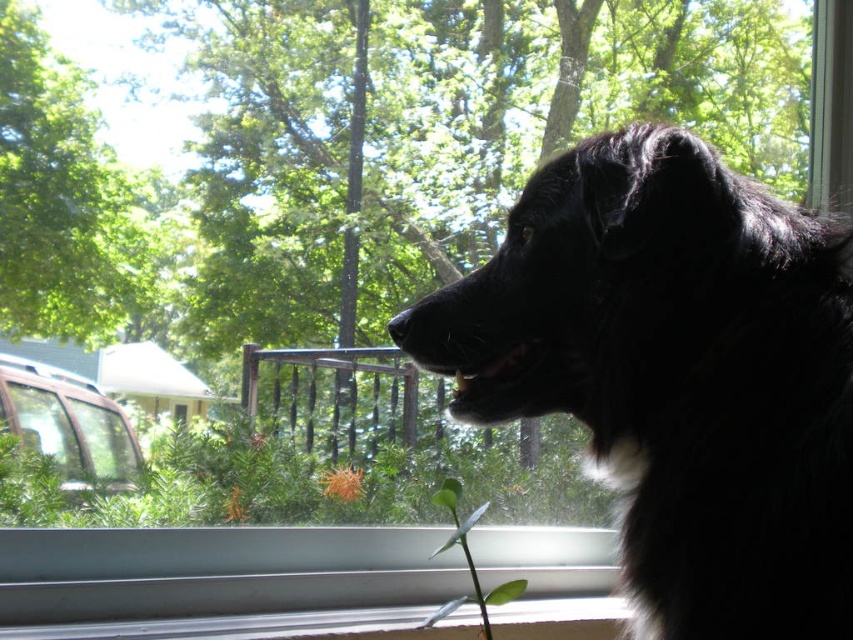
Does black fluffy dog at upper right have a smaller size compared to green leafy tree at upper left?

Incorrect, black fluffy dog at upper right is not smaller in size than green leafy tree at upper left.

Is point (712, 275) more distant than point (28, 234)?

That is False.

Between point (757, 426) and point (62, 259), which one is positioned in front?

Point (757, 426)

Where is `black fluffy dog at upper right`? black fluffy dog at upper right is located at coordinates (676, 374).

Which is more to the right, black fluffy dog at upper right or green leafy stem at lower center?

Positioned to the right is black fluffy dog at upper right.

Is point (799, 508) in front of point (451, 518)?

Yes, it is.

Measure the distance between black fluffy dog at upper right and camera.

A distance of 17.26 inches exists between black fluffy dog at upper right and camera.

The image size is (853, 640). In order to click on black fluffy dog at upper right in this screenshot , I will do `click(676, 374)`.

Is point (48, 88) closer to camera compared to point (434, 618)?

That is False.

Can you confirm if green leafy tree at upper left is wider than green leafy stem at lower center?

Indeed, green leafy tree at upper left has a greater width compared to green leafy stem at lower center.

Find the location of a particular element. green leafy tree at upper left is located at coordinates tap(62, 202).

Locate an element on the screen. This screenshot has width=853, height=640. green leafy tree at upper left is located at coordinates (62, 202).